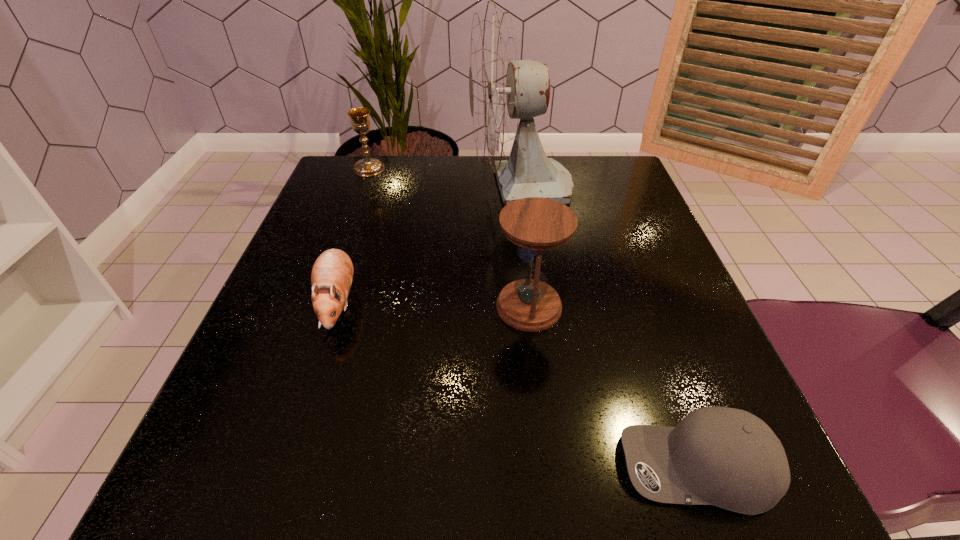
This screenshot has height=540, width=960. In order to click on vacant region located at the face of the hamster in this screenshot , I will do `click(312, 383)`.

What are the coordinates of `free space located 0.310m on the front brim of the nearest object` in the screenshot? It's located at (363, 467).

Locate an element on the screen. This screenshot has width=960, height=540. free space located on the front brim of the nearest object is located at coordinates (421, 467).

The width and height of the screenshot is (960, 540). What are the coordinates of `vacant space located 0.280m on the front brim of the nearest object` in the screenshot? It's located at (388, 467).

Locate an element on the screen. This screenshot has width=960, height=540. fan positioned at the far edge is located at coordinates (502, 89).

Locate an element on the screen. The height and width of the screenshot is (540, 960). chalice located in the far edge section of the desktop is located at coordinates (360, 121).

Locate an element on the screen. The width and height of the screenshot is (960, 540). object that is at the near edge is located at coordinates (729, 458).

Locate an element on the screen. The height and width of the screenshot is (540, 960). chalice at the left edge is located at coordinates (360, 121).

Identify the location of hamster located at the left edge. This screenshot has width=960, height=540. (332, 273).

Locate an element on the screen. Image resolution: width=960 pixels, height=540 pixels. fan that is at the right edge is located at coordinates (502, 89).